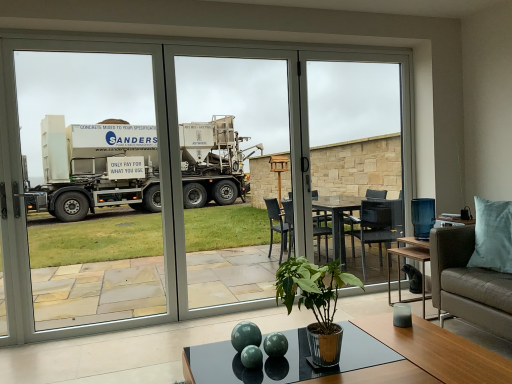
Question: Does green glossy plant at center touch transparent glass table at center?

Choices:
 (A) yes
 (B) no

Answer: (B)

Question: Is green glossy plant at center thinner than transparent glass table at center?

Choices:
 (A) no
 (B) yes

Answer: (A)

Question: Is green glossy plant at center behind transparent glass table at center?

Choices:
 (A) no
 (B) yes

Answer: (A)

Question: Is green glossy plant at center at the left side of transparent glass table at center?

Choices:
 (A) yes
 (B) no

Answer: (A)

Question: Is green glossy plant at center smaller than transparent glass table at center?

Choices:
 (A) no
 (B) yes

Answer: (B)

Question: In the image, is transparent glass door at left, the 2th screen door in the right-to-left sequence, positioned in front of or behind transparent glass table at center?

Choices:
 (A) front
 (B) behind

Answer: (A)

Question: Visually, is transparent glass door at left, which ranks as the first screen door in left-to-right order, positioned to the left or to the right of transparent glass table at center?

Choices:
 (A) right
 (B) left

Answer: (B)

Question: From their relative heights in the image, would you say transparent glass door at left, which ranks as the first screen door in left-to-right order, is taller or shorter than transparent glass table at center?

Choices:
 (A) tall
 (B) short

Answer: (A)

Question: Is transparent glass door at left, which ranks as the first screen door in left-to-right order, situated inside transparent glass table at center or outside?

Choices:
 (A) outside
 (B) inside

Answer: (A)

Question: Would you say transparent glass door at center, the first screen door viewed from the right, is to the left or to the right of green glossy plant at center in the picture?

Choices:
 (A) left
 (B) right

Answer: (A)

Question: Looking at their shapes, would you say transparent glass door at center, the first screen door viewed from the right, is wider or thinner than green glossy plant at center?

Choices:
 (A) thin
 (B) wide

Answer: (A)

Question: Is transparent glass door at center, the second screen door positioned from the left, taller or shorter than green glossy plant at center?

Choices:
 (A) short
 (B) tall

Answer: (B)

Question: Relative to green glossy plant at center, is transparent glass door at center, the first screen door viewed from the right, in front or behind?

Choices:
 (A) behind
 (B) front

Answer: (A)

Question: Is point 22,56 closer or farther from the camera than point 117,279?

Choices:
 (A) closer
 (B) farther

Answer: (B)

Question: From a real-world perspective, is transparent glass door at left, the 2th screen door in the right-to-left sequence, above or below transparent glass door at center?

Choices:
 (A) above
 (B) below

Answer: (A)